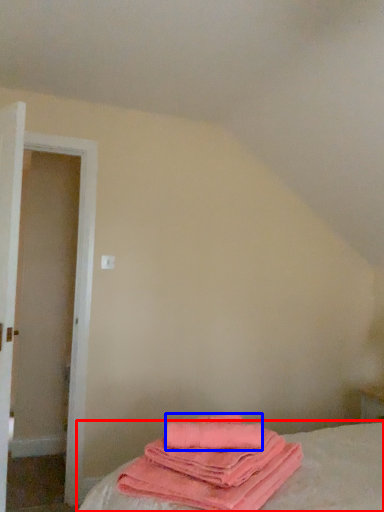
Question: Which of the following is the farthest to the observer, bed (highlighted by a red box) or beach towel (highlighted by a blue box)?

Choices:
 (A) bed
 (B) beach towel

Answer: (B)